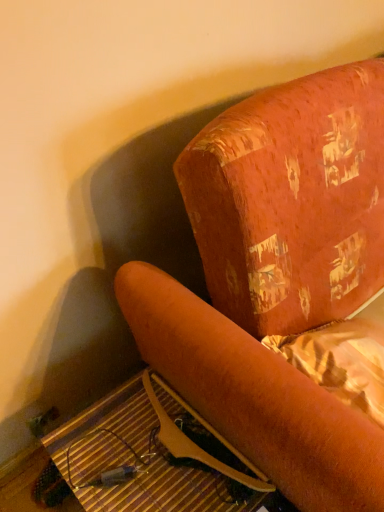
Question: In terms of size, does velvet orange armchair at center appear bigger or smaller than wooden at lower left?

Choices:
 (A) small
 (B) big

Answer: (B)

Question: From a real-world perspective, relative to wooden at lower left, is velvet orange armchair at center vertically above or below?

Choices:
 (A) above
 (B) below

Answer: (A)

Question: In terms of width, does velvet orange armchair at center look wider or thinner when compared to wooden at lower left?

Choices:
 (A) wide
 (B) thin

Answer: (A)

Question: Is wooden at lower left to the left or to the right of velvet orange armchair at center in the image?

Choices:
 (A) right
 (B) left

Answer: (B)

Question: Is wooden at lower left in front of or behind velvet orange armchair at center in the image?

Choices:
 (A) behind
 (B) front

Answer: (A)

Question: Looking at the image, does wooden at lower left seem bigger or smaller compared to velvet orange armchair at center?

Choices:
 (A) small
 (B) big

Answer: (A)

Question: In terms of width, does wooden at lower left look wider or thinner when compared to velvet orange armchair at center?

Choices:
 (A) thin
 (B) wide

Answer: (A)